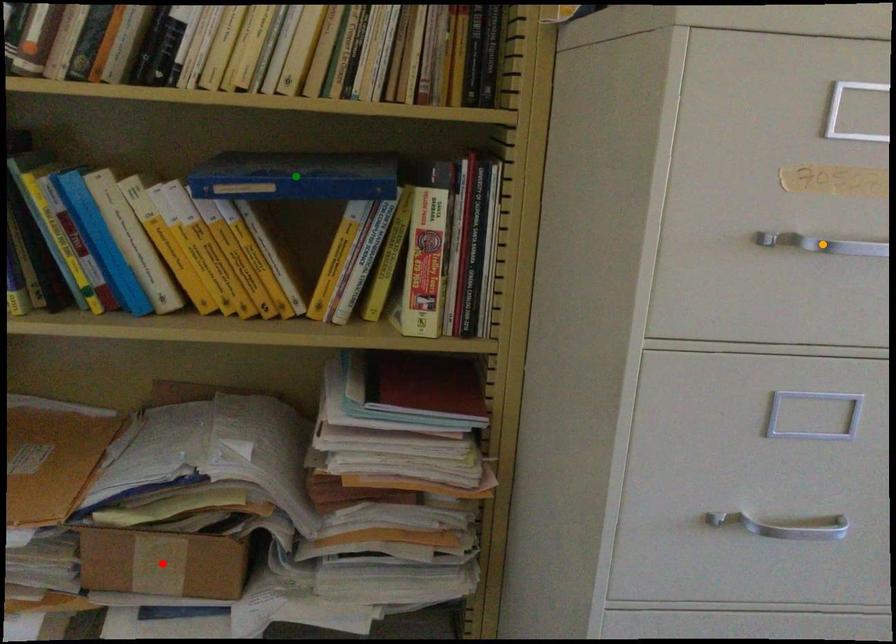
Order these from nearest to farthest:
1. green point
2. orange point
3. red point

red point
green point
orange point